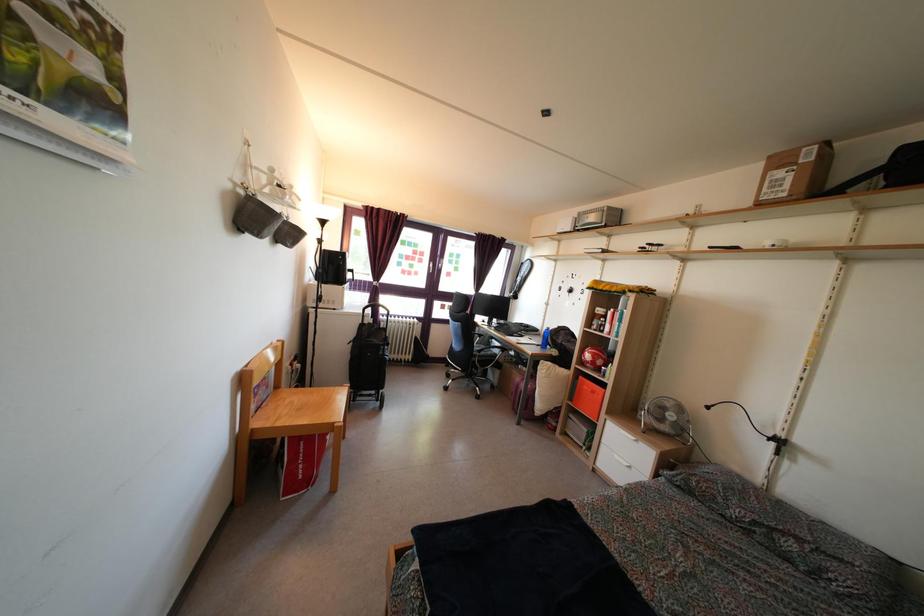
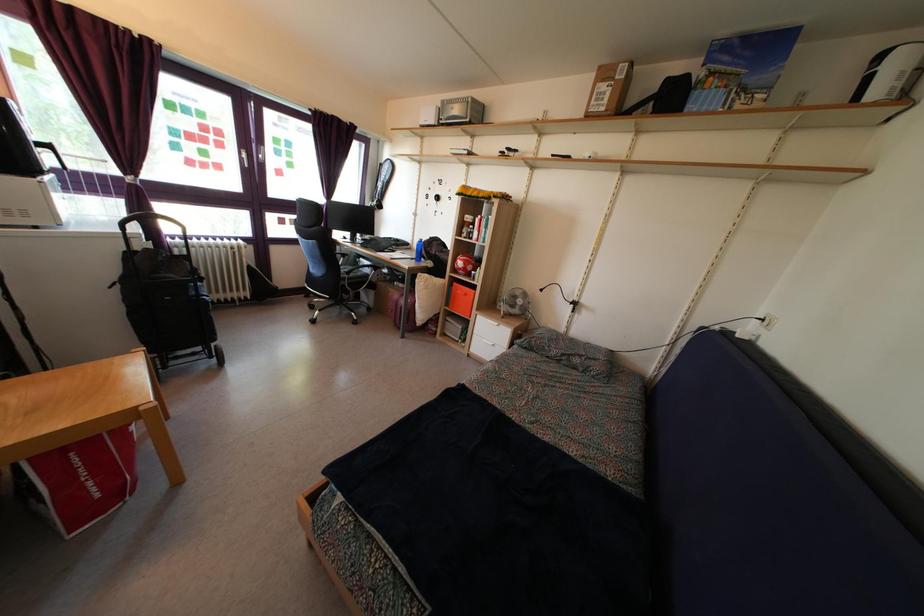
Where in the second image is the point corresponding to pixel 377 313 from the first image?

(146, 225)